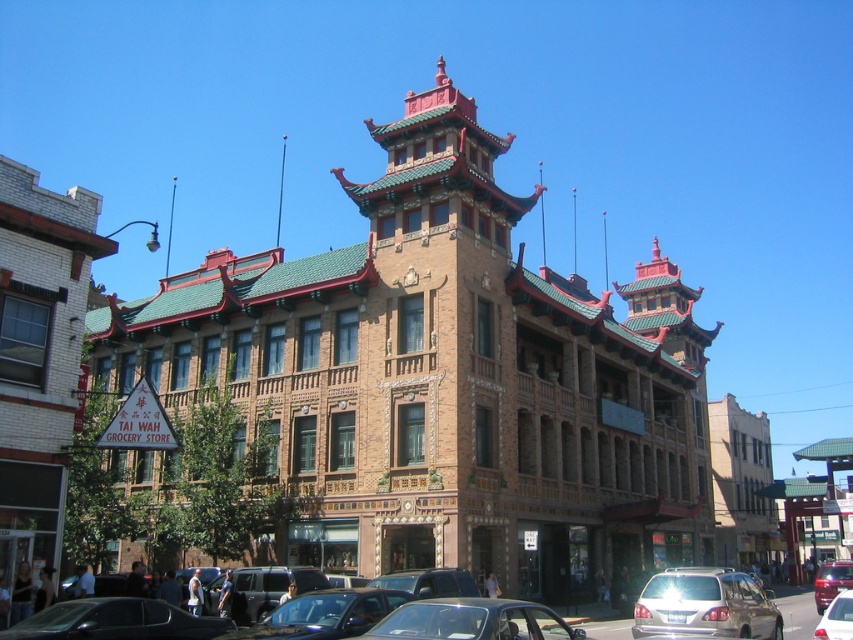
Question: Is brown brick building at center smaller than metallic silver car at center?

Choices:
 (A) yes
 (B) no

Answer: (B)

Question: Which point is farther to the camera?

Choices:
 (A) metallic silver car at lower right
 (B) shiny black car at lower center
 (C) shiny silver car at center

Answer: (C)

Question: Which object is the closest to the metallic silver car at lower right?

Choices:
 (A) shiny silver car at center
 (B) silver metallic station wagon at center
 (C) brown brick building at center
 (D) metallic silver car at center

Answer: (B)

Question: Does silver metallic station wagon at center appear on the right side of shiny silver car at center?

Choices:
 (A) yes
 (B) no

Answer: (B)

Question: Observing the image, what is the correct spatial positioning of brown brick building at center in reference to silver metallic station wagon at center?

Choices:
 (A) right
 (B) left

Answer: (B)

Question: Which object is positioned closest to the metallic silver car at lower right?

Choices:
 (A) shiny black car at lower center
 (B) brown brick building at center
 (C) silver metallic station wagon at center
 (D) shiny silver car at center

Answer: (C)